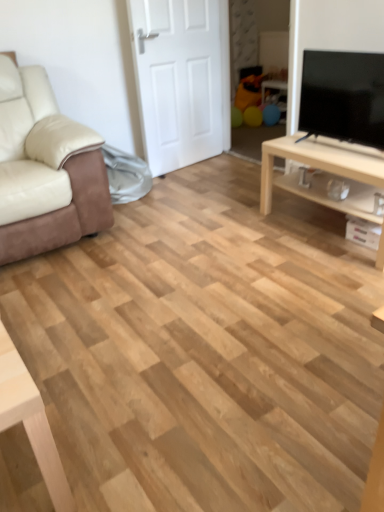
I want to click on vacant space situated on the left part of light wood/texture tv stand at right, so click(245, 238).